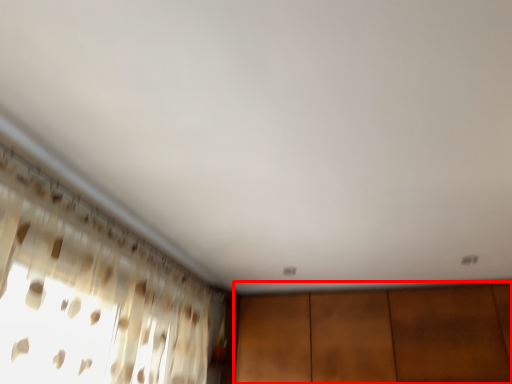
Question: From the image's perspective, where is dresser (annotated by the red box) located relative to curtain?

Choices:
 (A) above
 (B) below

Answer: (B)